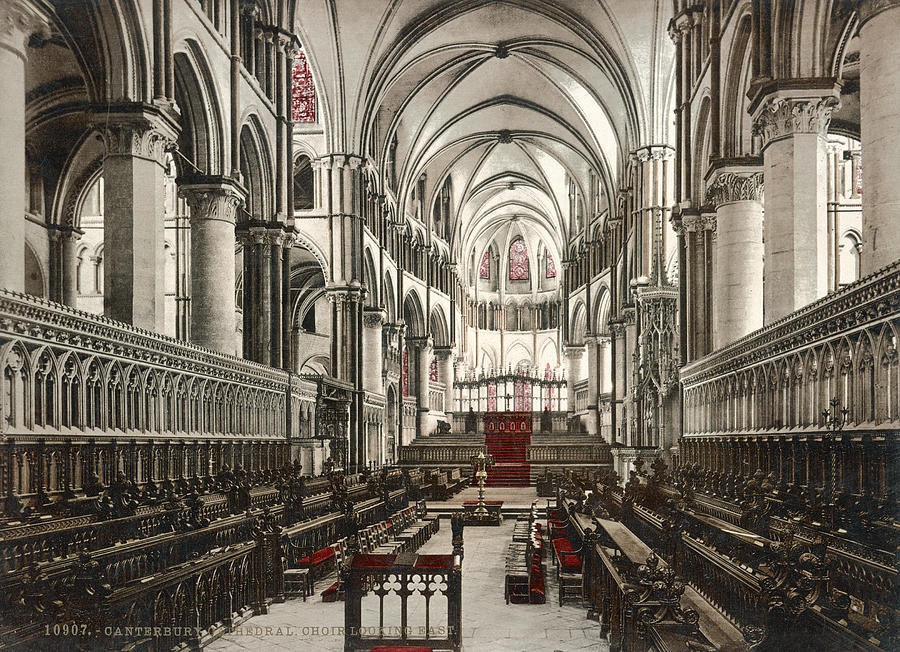
Identify the location of chair. This screenshot has height=652, width=900. (402, 597).